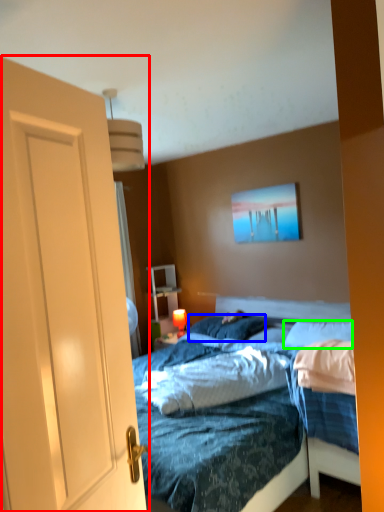
Question: Which object is the farthest from door (highlighted by a red box)? Choose among these: pillow (highlighted by a blue box) or pillow (highlighted by a green box).

Choices:
 (A) pillow
 (B) pillow

Answer: (A)